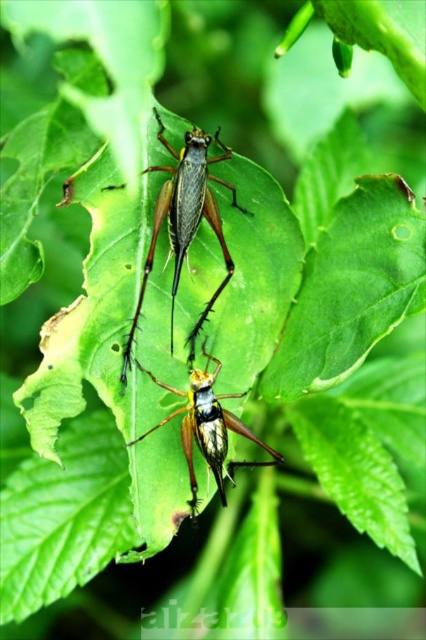
Question: Which object is farther from the camera taking this photo?

Choices:
 (A) shiny metallic grasshopper at center
 (B) shiny green grasshopper at center

Answer: (B)

Question: Can you confirm if shiny green grasshopper at center is bigger than shiny metallic grasshopper at center?

Choices:
 (A) yes
 (B) no

Answer: (A)

Question: In this image, where is shiny green grasshopper at center located relative to shiny metallic grasshopper at center?

Choices:
 (A) below
 (B) above

Answer: (B)

Question: Which point is farther from the camera taking this photo?

Choices:
 (A) (241, 461)
 (B) (169, 189)

Answer: (A)

Question: Is shiny green grasshopper at center above shiny metallic grasshopper at center?

Choices:
 (A) yes
 (B) no

Answer: (A)